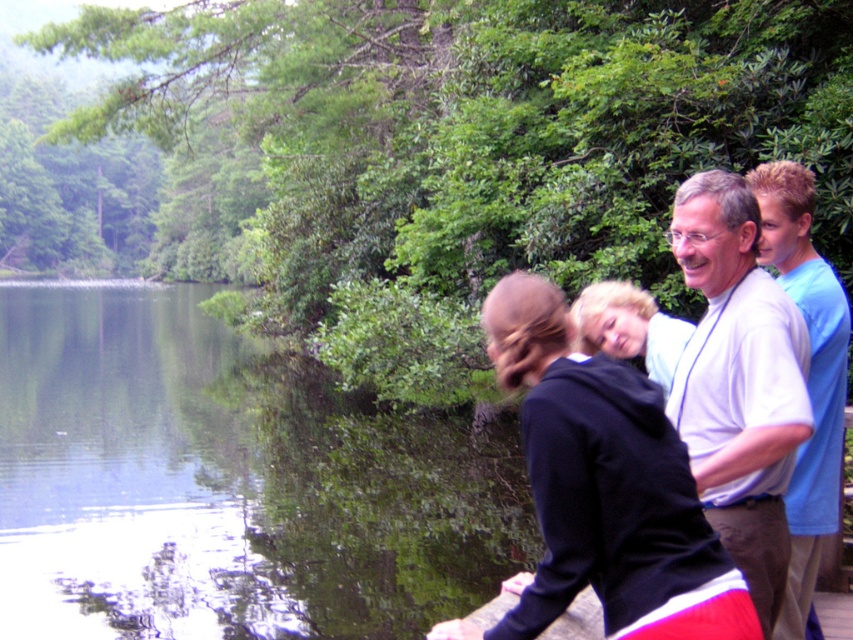
Question: Can you confirm if white cotton shirt at upper right is positioned to the right of blue cotton shirt at right?

Choices:
 (A) yes
 (B) no

Answer: (B)

Question: Considering the real-world distances, which object is farthest from the black hoodie at center?

Choices:
 (A) white cotton shirt at upper right
 (B) blue cotton shirt at right

Answer: (B)

Question: Which point is closer to the camera?

Choices:
 (A) blue cotton shirt at right
 (B) black hoodie at center
 (C) white cotton shirt at upper right

Answer: (B)

Question: From the image, what is the correct spatial relationship of black hoodie at center in relation to blue cotton shirt at right?

Choices:
 (A) right
 (B) left

Answer: (B)

Question: Can you confirm if white cotton shirt at upper right is positioned to the left of blue cotton shirt at right?

Choices:
 (A) no
 (B) yes

Answer: (B)

Question: Which point appears closest to the camera in this image?

Choices:
 (A) (775, 339)
 (B) (764, 230)

Answer: (A)